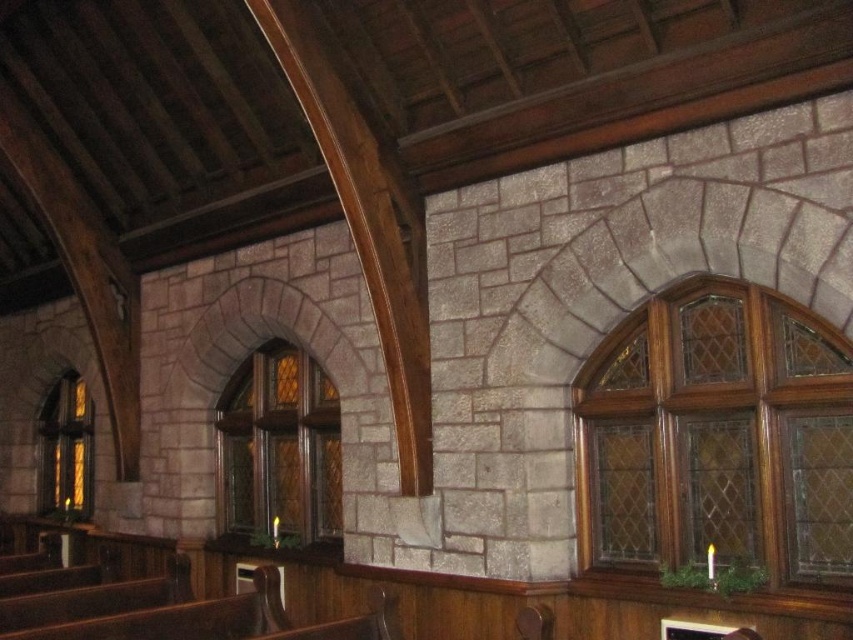
Question: Is stained glass window at upper right wider than stained glass window at left?

Choices:
 (A) yes
 (B) no

Answer: (A)

Question: Considering the relative positions of stained glass window at upper right and stained glass window at center in the image provided, where is stained glass window at upper right located with respect to stained glass window at center?

Choices:
 (A) right
 (B) left

Answer: (A)

Question: Can you confirm if stained glass window at center is positioned above stained glass window at left?

Choices:
 (A) no
 (B) yes

Answer: (B)

Question: Which object appears farthest from the camera in this image?

Choices:
 (A) stained glass window at center
 (B) stained glass window at left
 (C) stained glass window at upper right

Answer: (B)

Question: Among these points, which one is nearest to the camera?

Choices:
 (A) (79, 499)
 (B) (260, 518)
 (C) (730, 465)

Answer: (C)

Question: Which object is the farthest from the stained glass window at center?

Choices:
 (A) stained glass window at upper right
 (B) stained glass window at left

Answer: (B)